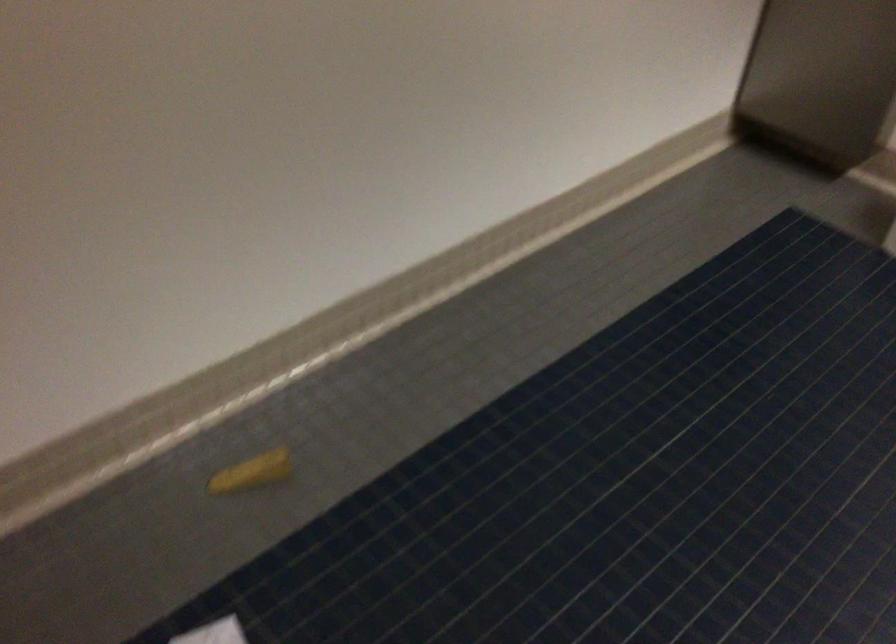
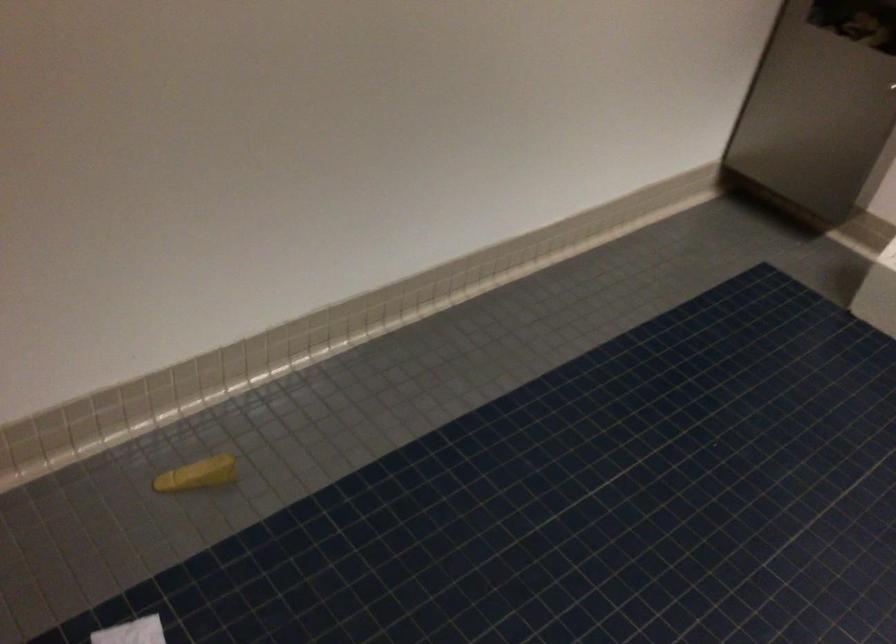
Question: Based on the continuous images, in which direction is the camera rotating? Reply with the corresponding letter.

Choices:
 (A) Left
 (B) Right
 (C) Up
 (D) Down

Answer: (C)